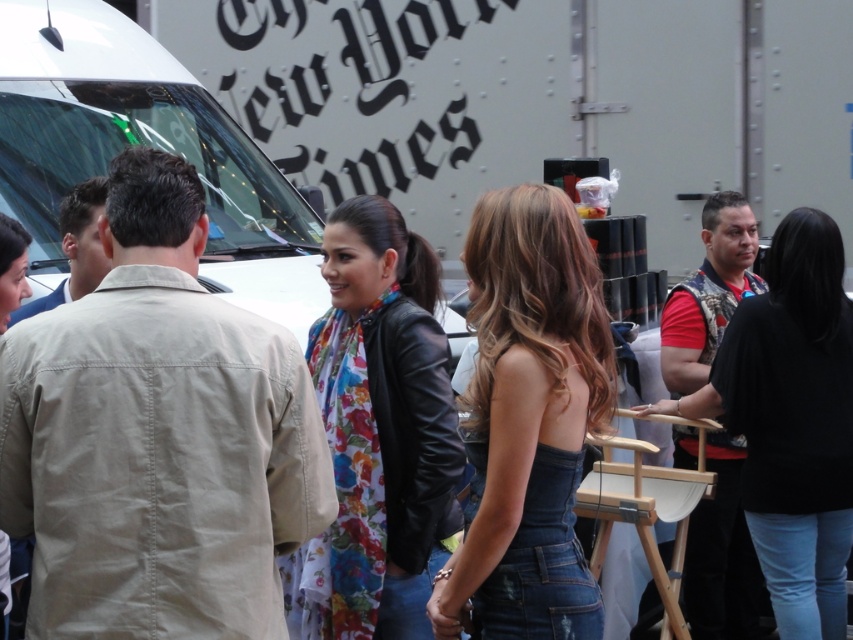
Is denim strapless top at center closer to camera compared to black leather jacket at right?

Yes, it is in front of black leather jacket at right.

Does point (537, 240) come closer to viewer compared to point (782, 371)?

Yes, it is in front of point (782, 371).

This screenshot has height=640, width=853. What are the coordinates of `denim strapless top at center` in the screenshot? It's located at (527, 420).

Can you confirm if denim strapless top at center is wider than floral scarf at center?

Indeed, denim strapless top at center has a greater width compared to floral scarf at center.

Who is more distant from viewer, (553, 577) or (24, 248)?

Positioned behind is point (24, 248).

Where is `denim strapless top at center`? The image size is (853, 640). denim strapless top at center is located at coordinates (527, 420).

Which is more to the left, floral fabric scarf at center or floral scarf at center?

From the viewer's perspective, floral scarf at center appears more on the left side.

Is point (338, 600) less distant than point (22, 230)?

No, it is behind (22, 230).

You are a GUI agent. You are given a task and a screenshot of the screen. Output one action in this format:
    pyautogui.click(x=<x>, y=<y>)
    Task: Click on the floral fabric scarf at center
    
    Given the screenshot: What is the action you would take?
    pyautogui.click(x=381, y=426)